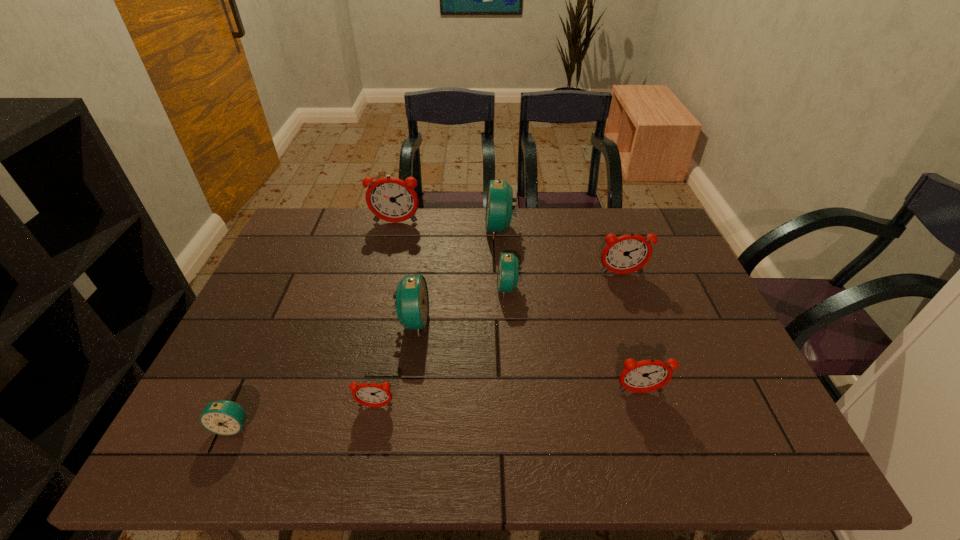
At what (x,y) coordinates should I click in order to perform the action: click on free space that satisfies the following two spatial constraints: 1. on the front-facing side of the biggest blue alarm clock; 2. on the front-facing side of the leftmost blue alarm clock. Please return your answer as a coordinate pair (x, y). The image size is (960, 540). Looking at the image, I should click on (512, 426).

Identify the location of vacant space that satisfies the following two spatial constraints: 1. on the front-facing side of the third nearest blue alarm clock; 2. on the front-facing side of the seventh farthest alarm clock. (516, 407).

I want to click on free space that satisfies the following two spatial constraints: 1. on the front-facing side of the second nearest blue alarm clock; 2. on the front-facing side of the leftmost blue alarm clock, so click(x=397, y=426).

The image size is (960, 540). I want to click on vacant space that satisfies the following two spatial constraints: 1. on the front-facing side of the second smallest blue alarm clock; 2. on the front-facing side of the nearest reddish-pink alarm clock, so click(516, 407).

The image size is (960, 540). In order to click on vacant space that satisfies the following two spatial constraints: 1. on the front-facing side of the second farthest reddish-pink alarm clock; 2. on the front-facing side of the third smallest blue alarm clock in this screenshot , I will do `click(638, 321)`.

In order to click on free spot that satisfies the following two spatial constraints: 1. on the front-facing side of the farthest blue alarm clock; 2. on the front-facing side of the nearest reddish-pink alarm clock in this screenshot , I will do (x=511, y=407).

Identify the location of vacant position in the image that satisfies the following two spatial constraints: 1. on the front-facing side of the biggest blue alarm clock; 2. on the front-facing side of the leftmost blue alarm clock. The image size is (960, 540). (512, 426).